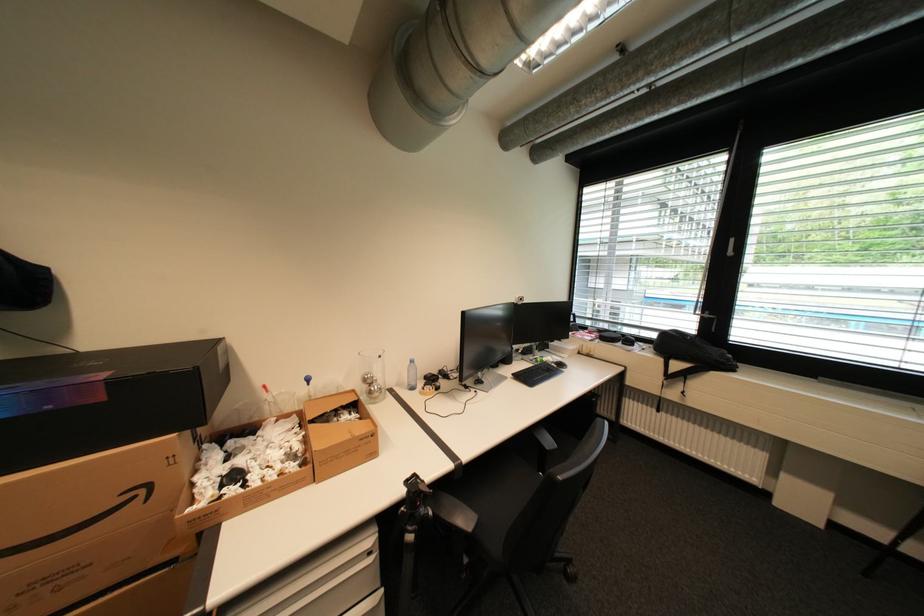
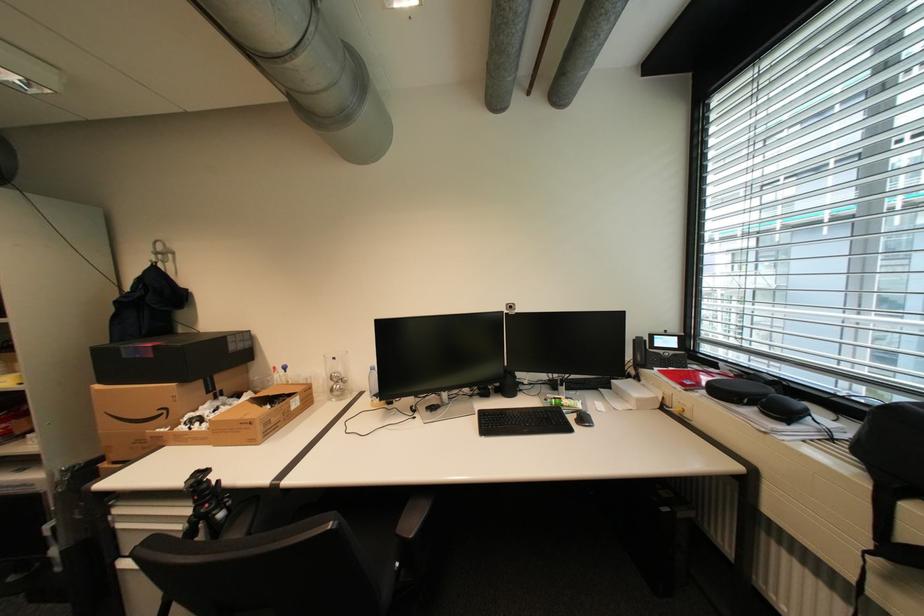
The point at (377,378) is marked in the first image. Where is the corresponding point in the second image?

(343, 376)